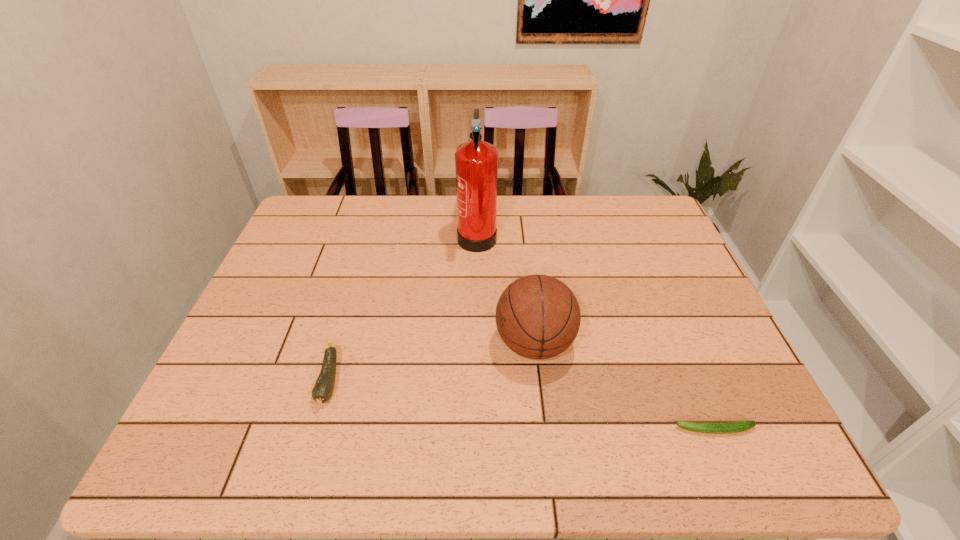
This screenshot has width=960, height=540. Identify the location of vacant space located on the side with brand label of the basketball. (428, 343).

Find the location of a particular element. The height and width of the screenshot is (540, 960). vacant space located at the blossom end of the left zucchini is located at coordinates 306,460.

The image size is (960, 540). What are the coordinates of `free space located 0.050m on the front-facing side of the right zucchini` in the screenshot? It's located at (651, 429).

Image resolution: width=960 pixels, height=540 pixels. I want to click on vacant space located 0.250m on the front-facing side of the right zucchini, so click(554, 429).

I want to click on vacant space located 0.100m on the front-facing side of the right zucchini, so click(627, 429).

Identify the location of object that is at the far edge. The image size is (960, 540). click(476, 162).

Locate an element on the screen. Image resolution: width=960 pixels, height=540 pixels. object that is positioned at the near edge is located at coordinates (740, 426).

The width and height of the screenshot is (960, 540). I want to click on object that is positioned at the right edge, so click(740, 426).

You are a GUI agent. You are given a task and a screenshot of the screen. Output one action in this format:
    pyautogui.click(x=<x>, y=<y>)
    Task: Click on the object that is positioned at the near right corner
    The height and width of the screenshot is (540, 960).
    Given the screenshot: What is the action you would take?
    pyautogui.click(x=740, y=426)

Find the location of `vacant space at the far edge of the desktop`. vacant space at the far edge of the desktop is located at coordinates (558, 238).